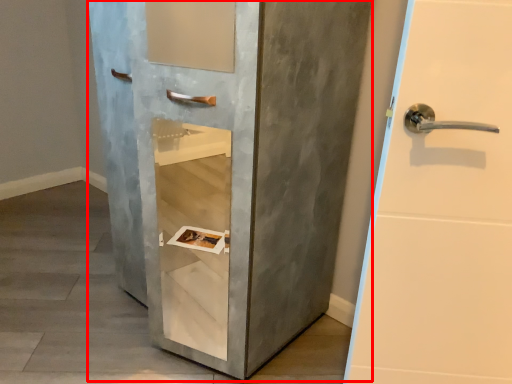
Question: From the image's perspective, what is the correct spatial positioning of door (annotated by the red box) in reference to concrete?

Choices:
 (A) below
 (B) above

Answer: (B)